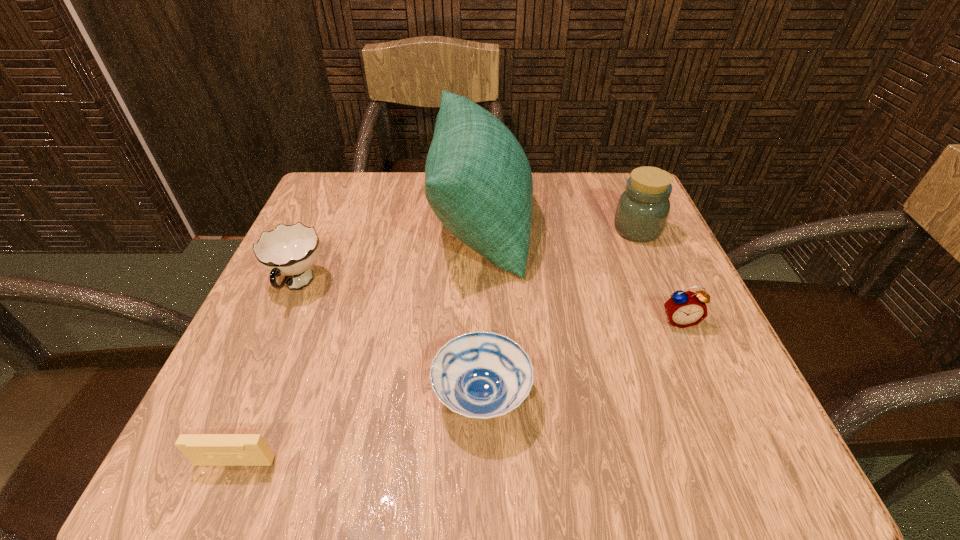
Find the location of a particular element. free space that is in between the cushion and the cup is located at coordinates (389, 253).

Where is `free space between the cup and the third nearest object`? free space between the cup and the third nearest object is located at coordinates pyautogui.click(x=488, y=302).

At what (x,y) coordinates should I click in order to perform the action: click on vacant space in between the tallest object and the soup bowl. Please return your answer as a coordinate pair (x, y). This screenshot has height=540, width=960. Looking at the image, I should click on (481, 309).

I want to click on vacant region between the fifth shortest object and the soup bowl, so click(x=560, y=313).

This screenshot has width=960, height=540. Find the location of `free space between the tallest object and the second nearest object`. free space between the tallest object and the second nearest object is located at coordinates (481, 309).

Locate an element on the screen. Image resolution: width=960 pixels, height=540 pixels. free space between the fourth farthest object and the cup is located at coordinates (488, 302).

This screenshot has height=540, width=960. Identify the location of free space between the second nearest object and the third nearest object. (581, 359).

Where is `vacant area between the soup bowl and the cup`? vacant area between the soup bowl and the cup is located at coordinates pos(390,341).

Locate an element on the screen. The image size is (960, 540). object that is the fifth closest to the fifth shortest object is located at coordinates (201, 449).

Where is `the second closest object to the videotape`? the second closest object to the videotape is located at coordinates point(288,250).